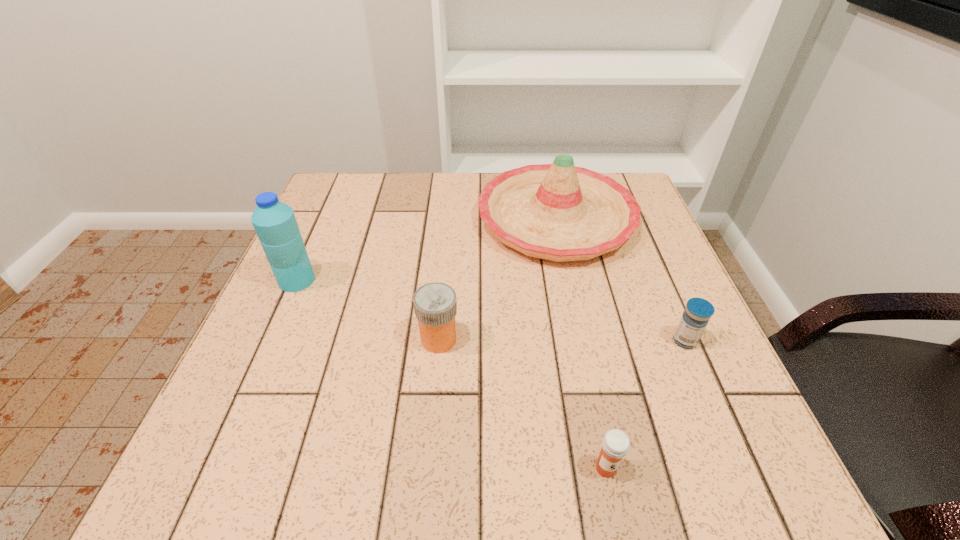
You are a GUI agent. You are given a task and a screenshot of the screen. Output one action in this format:
    pyautogui.click(x=<x>, y=<y>)
    Task: Click on the vacant region at the right edge of the desktop
    The height and width of the screenshot is (540, 960).
    Given the screenshot: What is the action you would take?
    pyautogui.click(x=603, y=261)

Find the location of `vacant space at the far left corner of the desktop`. vacant space at the far left corner of the desktop is located at coordinates (353, 180).

The height and width of the screenshot is (540, 960). In order to click on unoccupied area between the tallest medicine and the second medicine from left to right in this screenshot , I will do (x=522, y=404).

Locate an element on the screen. empty space between the fourth shortest object and the water bottle is located at coordinates (426, 250).

This screenshot has width=960, height=540. Identify the location of vacant area that lies between the second tallest object and the leftmost medicine. (497, 279).

Locate an element on the screen. The image size is (960, 540). free space between the rightmost medicine and the sombrero is located at coordinates (620, 280).

Locate an element on the screen. The height and width of the screenshot is (540, 960). free space that is in between the leftmost object and the nearest medicine is located at coordinates (451, 374).

Locate an element on the screen. unoccupied position between the rightmost medicine and the fourth shortest object is located at coordinates click(620, 280).

Where is `vacant area that lies between the tallest medicine and the second medicine from left to right`? vacant area that lies between the tallest medicine and the second medicine from left to right is located at coordinates (522, 404).

Locate an element on the screen. The width and height of the screenshot is (960, 540). blank region between the water bottle and the second tallest object is located at coordinates (426, 250).